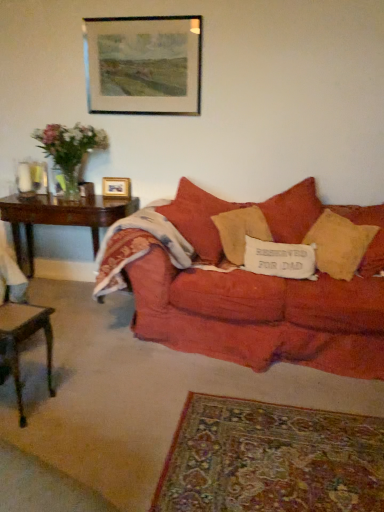
Where is `vacant area on top of wooden side table at lower left, arranged as the second table when viewed from the back (from a real-world perspective)`? The width and height of the screenshot is (384, 512). vacant area on top of wooden side table at lower left, arranged as the second table when viewed from the back (from a real-world perspective) is located at coordinates (16, 313).